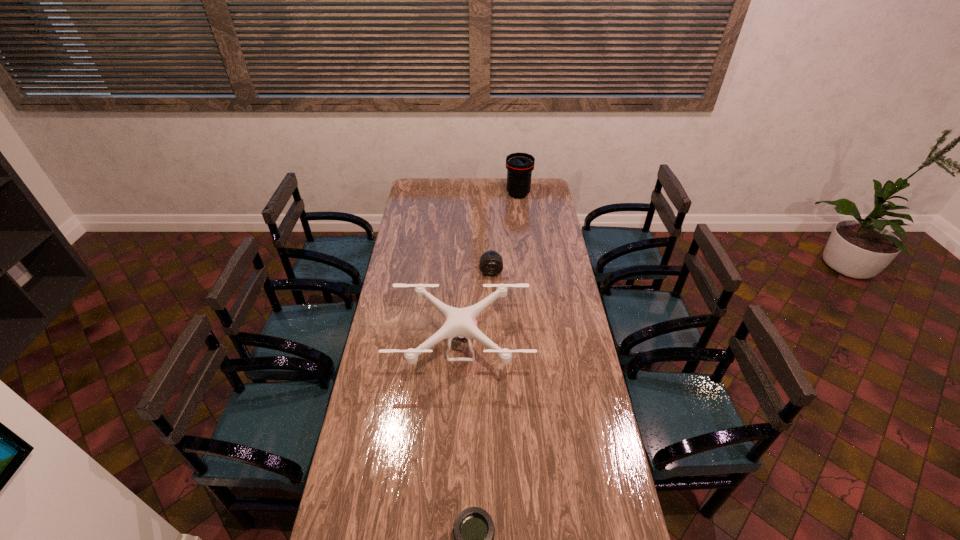
Identify which telephoto lens is the second nearest to the farthest telephoto lens. Please provide its 2D coordinates. Your answer should be formatted as a tuple, i.e. [(x, y)], where the tuple contains the x and y coordinates of a point satisfying the conditions above.

[(474, 531)]